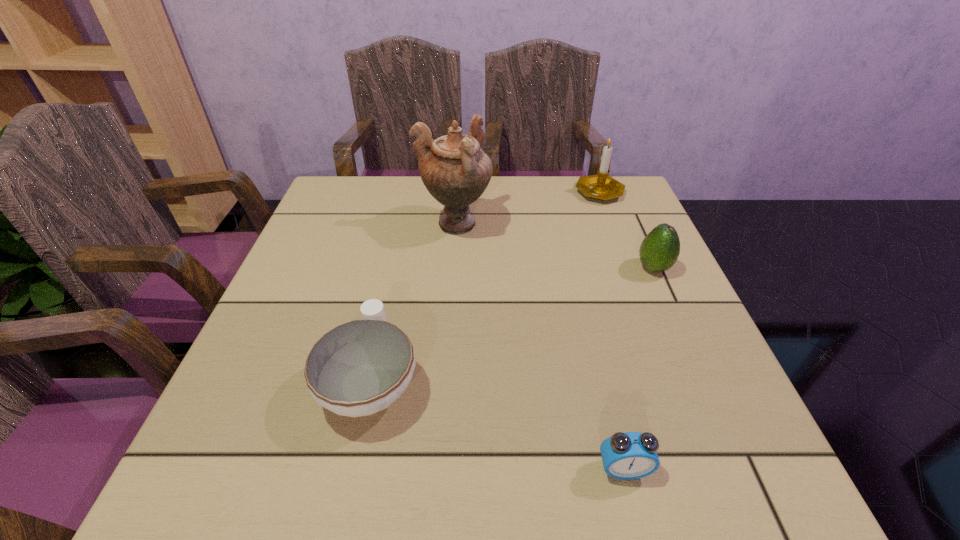
Image resolution: width=960 pixels, height=540 pixels. I want to click on vacant space that's between the tallest object and the fourth shortest object, so pos(527,207).

Find the location of `vacant area between the tallest object and the chinaware`. vacant area between the tallest object and the chinaware is located at coordinates point(413,302).

You are a GUI agent. You are given a task and a screenshot of the screen. Output one action in this format:
    pyautogui.click(x=<x>, y=<y>)
    Task: Click on the vacant space in between the alarm clock and the urn
    
    Given the screenshot: What is the action you would take?
    pyautogui.click(x=539, y=346)

Identify the location of unoccupied area between the chinaware and the avocado. (513, 324).

Identify the location of vacant area between the second tallest object and the urn. (527, 207).

Image resolution: width=960 pixels, height=540 pixels. Identify the location of vacant region between the alarm clock and the third shortest object. (638, 368).

Locate which object ranks in proximity to the fourth farthest object. Please provide its 2D coordinates. Your answer should be formatted as a tuple, i.e. [(x, y)], where the tuple contains the x and y coordinates of a point satisfying the conditions above.

[(455, 170)]

Locate which object is the third closest to the tallest object. Please provide its 2D coordinates. Your answer should be formatted as a tuple, i.e. [(x, y)], where the tuple contains the x and y coordinates of a point satisfying the conditions above.

[(659, 250)]

I want to click on free space that satisfies the following two spatial constraints: 1. on the side with the handle of the chinaware; 2. on the left side of the second tallest object, so click(x=413, y=191).

The image size is (960, 540). In order to click on vacant space that satisfies the following two spatial constraints: 1. on the side with the handle of the chinaware; 2. on the left side of the candle holder in this screenshot , I will do `click(413, 191)`.